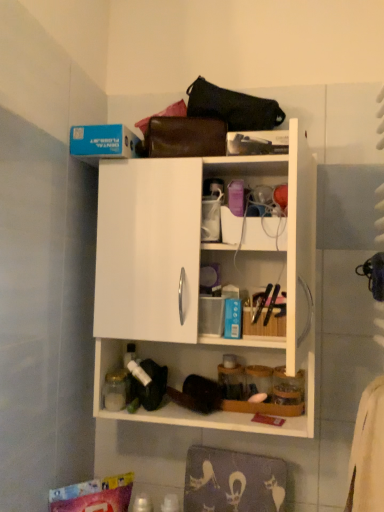
Question: In terms of height, does white matte cabinet at upper center look taller or shorter compared to leather handbag at upper center, acting as the second handbag starting from the top?

Choices:
 (A) tall
 (B) short

Answer: (A)

Question: From the image's perspective, relative to leather handbag at upper center, acting as the second handbag starting from the top, is white matte cabinet at upper center above or below?

Choices:
 (A) above
 (B) below

Answer: (B)

Question: Considering the real-world distances, which object is farthest from the white matte cabinet at upper center?

Choices:
 (A) leather handbag at upper center, acting as the second handbag starting from the top
 (B) black leather handbag at upper center, which is the second handbag in bottom-to-top order

Answer: (B)

Question: Estimate the real-world distances between objects in this image. Which object is farther from the black leather handbag at upper center, which is the second handbag in bottom-to-top order?

Choices:
 (A) leather handbag at upper center, acting as the second handbag starting from the top
 (B) white matte cabinet at upper center

Answer: (B)